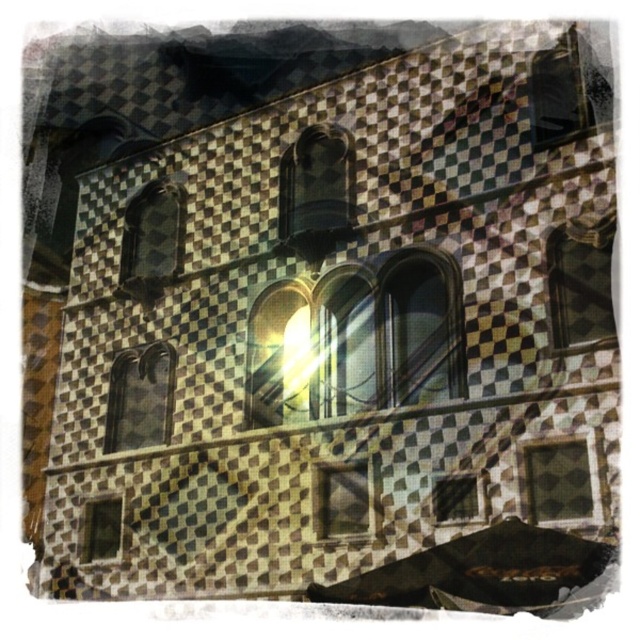
Question: Does matte glass window at center left appear on the right side of matte glass window at lower left?

Choices:
 (A) no
 (B) yes

Answer: (B)

Question: Which point is farther to the camera?

Choices:
 (A) pos(160,429)
 (B) pos(180,216)

Answer: (B)

Question: Is matte glass window at upper left wider than matte glass window at lower left?

Choices:
 (A) no
 (B) yes

Answer: (A)

Question: Is matte checkered glass window at lower right thinner than matte glass window at lower left?

Choices:
 (A) yes
 (B) no

Answer: (B)

Question: Which is farther from the matte glass window at center?

Choices:
 (A) matte glass window at center left
 (B) matte glass window at lower left
 (C) matte checkered glass window at lower right

Answer: (A)

Question: Which is nearer to the matte glass window at lower left?

Choices:
 (A) matte glass window at center left
 (B) translucent glass window at center

Answer: (A)